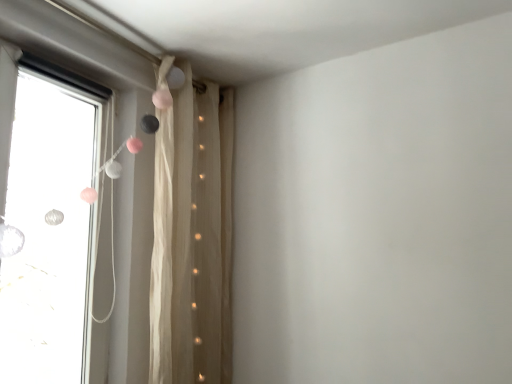
Question: From a real-world perspective, is transparent glass window at left beneath sheer beige curtain at upper center?

Choices:
 (A) yes
 (B) no

Answer: (B)

Question: From a real-world perspective, is transparent glass window at left positioned over sheer beige curtain at upper center based on gravity?

Choices:
 (A) no
 (B) yes

Answer: (B)

Question: Is transparent glass window at left looking in the opposite direction of sheer beige curtain at upper center?

Choices:
 (A) no
 (B) yes

Answer: (A)

Question: Considering the relative sizes of transparent glass window at left and sheer beige curtain at upper center in the image provided, is transparent glass window at left shorter than sheer beige curtain at upper center?

Choices:
 (A) no
 (B) yes

Answer: (B)

Question: Considering the relative sizes of transparent glass window at left and sheer beige curtain at upper center in the image provided, is transparent glass window at left bigger than sheer beige curtain at upper center?

Choices:
 (A) no
 (B) yes

Answer: (A)

Question: Is transparent glass window at left to the right of sheer beige curtain at upper center from the viewer's perspective?

Choices:
 (A) no
 (B) yes

Answer: (A)

Question: Is sheer beige curtain at upper center smaller than transparent glass window at left?

Choices:
 (A) no
 (B) yes

Answer: (A)

Question: From a real-world perspective, is sheer beige curtain at upper center positioned over transparent glass window at left based on gravity?

Choices:
 (A) yes
 (B) no

Answer: (B)

Question: Considering the relative sizes of sheer beige curtain at upper center and transparent glass window at left in the image provided, is sheer beige curtain at upper center bigger than transparent glass window at left?

Choices:
 (A) yes
 (B) no

Answer: (A)

Question: Does sheer beige curtain at upper center have a greater width compared to transparent glass window at left?

Choices:
 (A) yes
 (B) no

Answer: (A)

Question: Can you confirm if sheer beige curtain at upper center is positioned to the left of transparent glass window at left?

Choices:
 (A) yes
 (B) no

Answer: (B)

Question: Considering the relative sizes of sheer beige curtain at upper center and transparent glass window at left in the image provided, is sheer beige curtain at upper center shorter than transparent glass window at left?

Choices:
 (A) yes
 (B) no

Answer: (B)

Question: Does point (199, 352) appear closer or farther from the camera than point (117, 59)?

Choices:
 (A) closer
 (B) farther

Answer: (B)